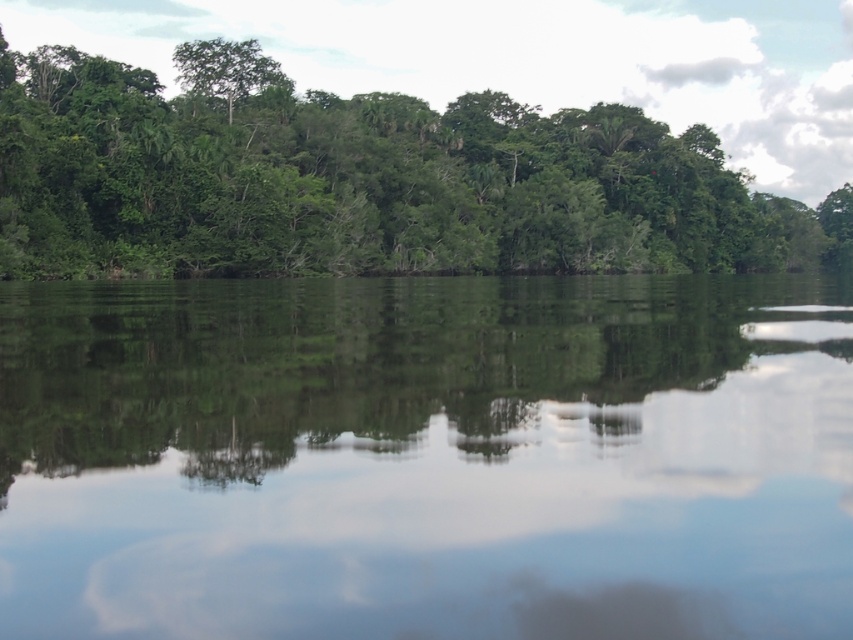
Between green leafy trees at upper center and green leafy tree at upper left, which one has less height?

Standing shorter between the two is green leafy trees at upper center.

Where is `green leafy trees at upper center`? green leafy trees at upper center is located at coordinates (363, 180).

The width and height of the screenshot is (853, 640). In order to click on green leafy trees at upper center in this screenshot , I will do [363, 180].

Who is lower down, transparent water at center or green leafy trees at upper center?

transparent water at center is below.

Which is more to the right, transparent water at center or green leafy trees at upper center?

green leafy trees at upper center is more to the right.

The height and width of the screenshot is (640, 853). In order to click on transparent water at center in this screenshot , I will do `click(427, 458)`.

Can you confirm if transparent water at center is smaller than green leafy tree at upper left?

Correct, transparent water at center occupies less space than green leafy tree at upper left.

Does transparent water at center appear under green leafy tree at upper left?

Yes, transparent water at center is below green leafy tree at upper left.

The width and height of the screenshot is (853, 640). I want to click on transparent water at center, so click(x=427, y=458).